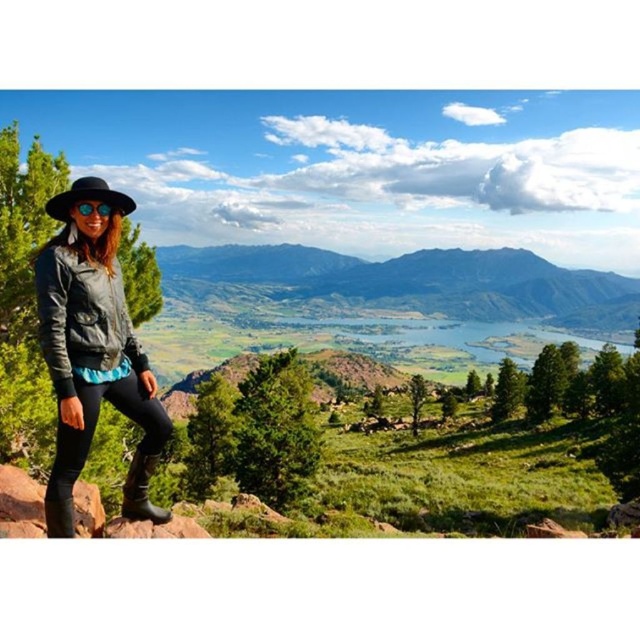
This screenshot has height=640, width=640. Describe the element at coordinates (396, 285) in the screenshot. I see `green grassy mountain at center` at that location.

Can you confirm if green grassy mountain at center is taller than matte black jacket at left?

Indeed, green grassy mountain at center has a greater height compared to matte black jacket at left.

Which is behind, point (380, 307) or point (67, 205)?

Point (380, 307)

I want to click on green grassy mountain at center, so click(x=396, y=285).

Is matte black jacket at left shorter than sunglasses at left?

No, matte black jacket at left is not shorter than sunglasses at left.

Who is positioned more to the left, matte black jacket at left or sunglasses at left?

From the viewer's perspective, matte black jacket at left appears more on the left side.

Who is more forward, [61,428] or [106,202]?

Point [61,428]

Identify the location of matte black jacket at left. The width and height of the screenshot is (640, 640). [93, 353].

Is green grassy mountain at center to the left of sunglasses at left from the viewer's perspective?

No, green grassy mountain at center is not to the left of sunglasses at left.

Is green grassy mountain at center closer to camera compared to sunglasses at left?

No, it is behind sunglasses at left.

Is point (570, 289) positioned behind point (81, 209)?

Yes, point (570, 289) is farther from viewer.

The width and height of the screenshot is (640, 640). What are the coordinates of `green grassy mountain at center` in the screenshot? It's located at (396, 285).